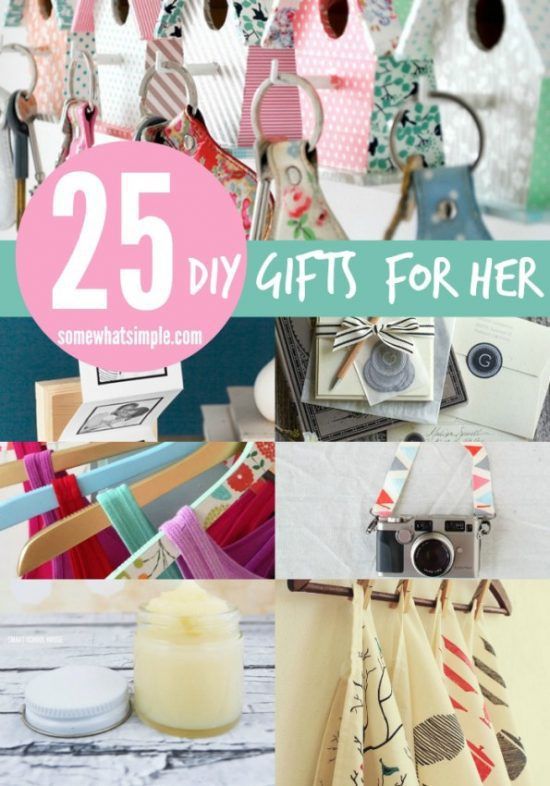
Locate an element on the screen. The image size is (550, 786). jar is located at coordinates (185, 656).